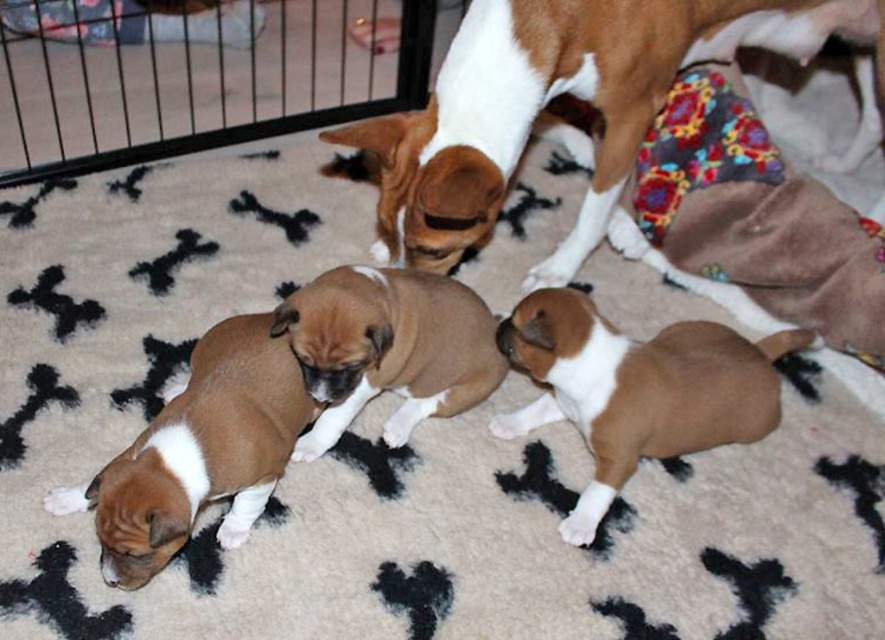
You are a photographer trying to capture a picture of both the brown matte puppy at lower right and the brown soft fur puppy at lower left. Since you want to include both in the frame, which puppy should you position closer to the camera to ensure both are visible?

The brown matte puppy at lower right is located below the brown soft fur puppy at lower left. To include both in the frame, position the brown matte puppy at lower right closer to the camera so that it can be seen along with the brown soft fur puppy at lower left.

You are a visitor entering the living room and see the brown and white fur at upper center and the black metal cage at upper left. Which object is nearer to you?

The brown and white fur at upper center is closer to the viewer than the black metal cage at upper left.